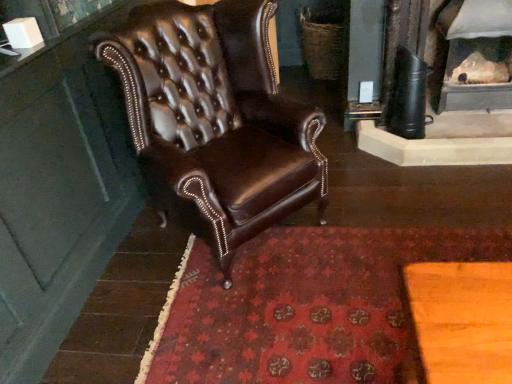
Question: Would you say brown leather chair at center is inside or outside white textured fireplace at upper right?

Choices:
 (A) inside
 (B) outside

Answer: (B)

Question: Is point (209, 34) closer or farther from the camera than point (508, 82)?

Choices:
 (A) farther
 (B) closer

Answer: (B)

Question: Based on their relative distances, which object is farther from the white textured fireplace at upper right?

Choices:
 (A) brown leather chair at center
 (B) red carpet at center

Answer: (A)

Question: Which object is the closest to the brown leather chair at center?

Choices:
 (A) red carpet at center
 (B) white textured fireplace at upper right

Answer: (A)